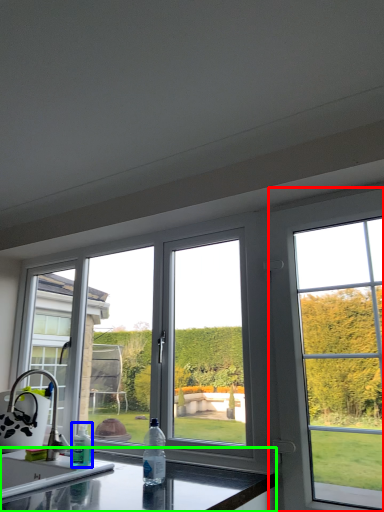
Question: Based on their relative distances, which object is nearer to window (highlighted by a red box)? Choose from bottle (highlighted by a blue box) and countertop (highlighted by a green box).

Choices:
 (A) bottle
 (B) countertop

Answer: (B)